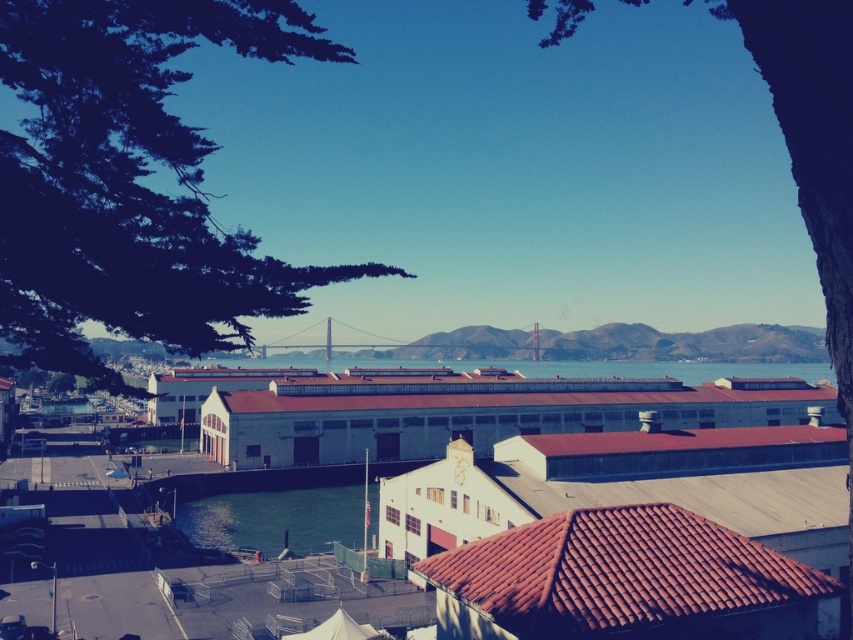
Question: Among these points, which one is nearest to the camera?

Choices:
 (A) (761, 365)
 (B) (287, 348)

Answer: (B)

Question: Is green leafy tree at upper left wider than green water at lower center?

Choices:
 (A) yes
 (B) no

Answer: (A)

Question: Can you confirm if clear blue water at center is smaller than metallic bridge at center?

Choices:
 (A) yes
 (B) no

Answer: (B)

Question: Can you confirm if clear blue water at center is positioned to the right of metallic bridge at center?

Choices:
 (A) no
 (B) yes

Answer: (B)

Question: Which point is farther from the camera taking this photo?

Choices:
 (A) (305, 524)
 (B) (704, 380)
 (C) (93, 150)

Answer: (B)

Question: Which object is farther from the camera taking this photo?

Choices:
 (A) clear blue water at center
 (B) metallic bridge at center
 (C) green leafy tree at upper left

Answer: (B)